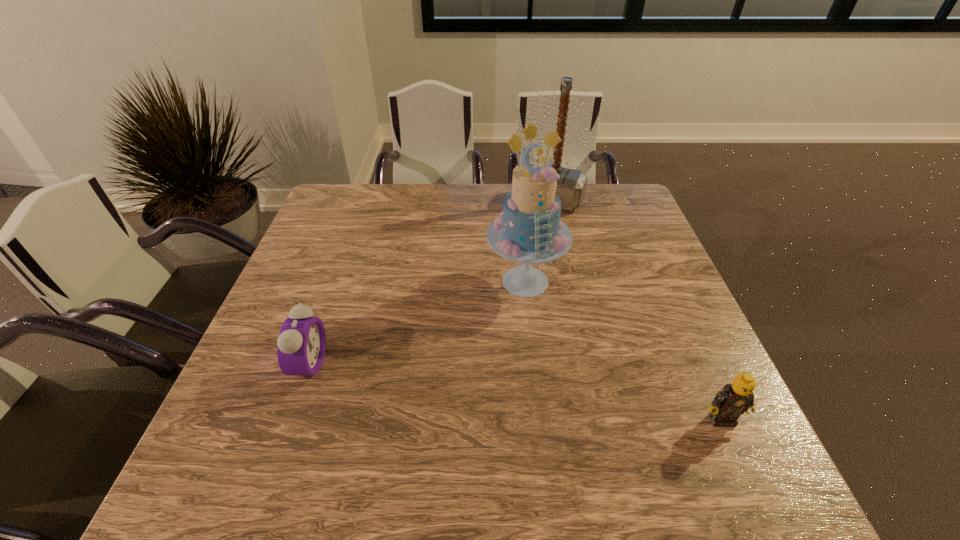
The width and height of the screenshot is (960, 540). I want to click on alarm clock, so click(301, 344).

Identify the location of the leftmost object. The image size is (960, 540). (301, 344).

Locate an element on the screen. the nearest object is located at coordinates (734, 399).

Image resolution: width=960 pixels, height=540 pixels. In order to click on Lego in this screenshot , I will do `click(734, 399)`.

The width and height of the screenshot is (960, 540). I want to click on cake, so click(529, 230).

Locate an element on the screen. hammer is located at coordinates (571, 186).

This screenshot has width=960, height=540. I want to click on vacant space located on the face of the third farthest object, so click(498, 363).

Locate an element on the screen. The width and height of the screenshot is (960, 540). free space located 0.080m with a ladder on the side of the cake is located at coordinates (510, 333).

Identify the location of free region located with a ladder on the side of the cake. Image resolution: width=960 pixels, height=540 pixels. (481, 434).

Locate an element on the screen. This screenshot has width=960, height=540. vacant point located 0.170m with a ladder on the side of the cake is located at coordinates (501, 363).